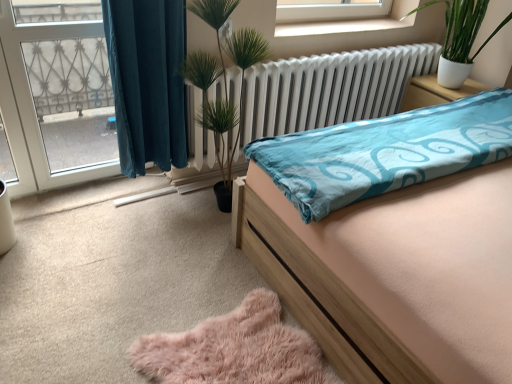
Question: From a real-world perspective, relative to teal fabric curtain at left, is wooden bed at center vertically above or below?

Choices:
 (A) above
 (B) below

Answer: (B)

Question: From the image's perspective, is wooden bed at center positioned above or below teal fabric curtain at left?

Choices:
 (A) above
 (B) below

Answer: (B)

Question: Estimate the real-world distances between objects in this image. Which object is farther from the fluffy pink rug at lower center?

Choices:
 (A) white metallic radiator at center
 (B) green glossy plant at upper right
 (C) wooden bed at center
 (D) teal fabric curtain at left
 (E) transparent glass door at left

Answer: (B)

Question: Based on their relative distances, which object is farther from the white glossy nightstand at upper right?

Choices:
 (A) green glossy plant at upper right
 (B) wooden bed at center
 (C) teal fabric curtain at left
 (D) white metallic radiator at center
 (E) fluffy pink rug at lower center

Answer: (E)